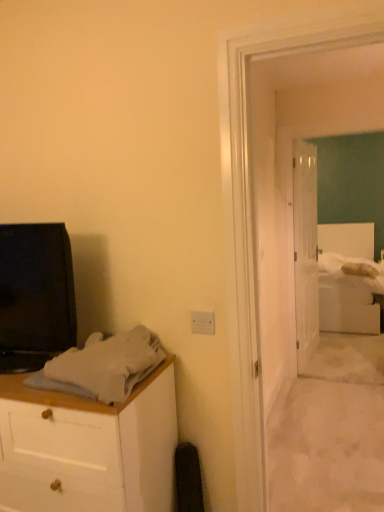
I want to click on vacant location below white glossy door at center (from a real-world perspective), so click(x=306, y=358).